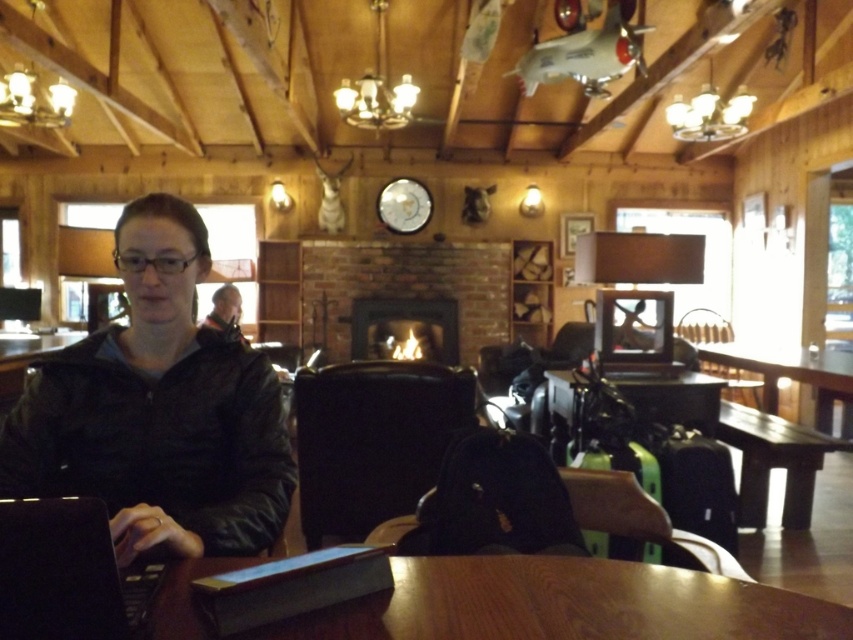
Which of these two, matte black jacket at left or brown wood table at lower center, stands shorter?

Standing shorter between the two is brown wood table at lower center.

Which is above, matte black jacket at left or brown wood table at lower center?

matte black jacket at left is higher up.

Is point (250, 404) positioned behind point (599, 609)?

Yes, point (250, 404) is behind point (599, 609).

The width and height of the screenshot is (853, 640). Find the location of `matte black jacket at left`. matte black jacket at left is located at coordinates (158, 410).

Who is more distant from viewer, [175,572] or [45,509]?

Point [175,572]

Locate an element on the screen. This screenshot has height=640, width=853. brown wood table at lower center is located at coordinates (566, 604).

Is point (148, 422) positioned in front of point (744, 356)?

Yes.

Is matte black jacket at left taller than wooden table at center?

Yes.

Locate an element on the screen. matte black jacket at left is located at coordinates (158, 410).